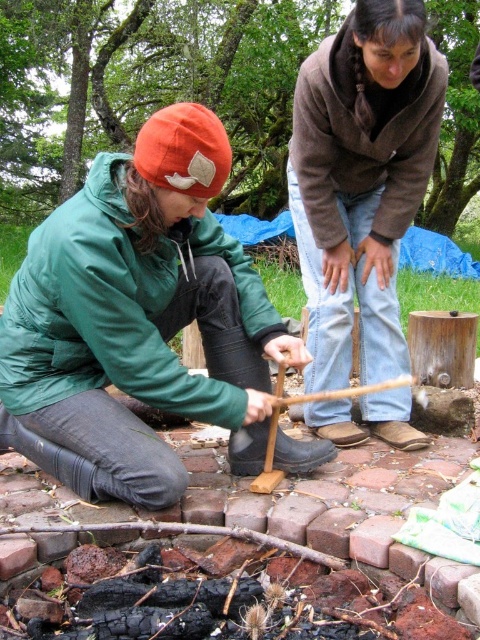
Based on the photo, you are standing at the center of the image and want to move towards the matte green jacket at center. Which direction should you move in?

The matte green jacket at center is located at point 0.500 in the x and 0.287 in the y coordinates, so you should move towards the lower center direction to reach it.

You are a photographer trying to capture a candid shot of both the matte green jacket at center and the brown fuzzy sweater at upper center. Since you want to ensure both are fully visible in the frame, which clothing item should you focus on first to adjust your camera angle?

The matte green jacket at center is shorter than the brown fuzzy sweater at upper center, so you should focus on adjusting your camera angle to ensure the shorter matte green jacket at center is fully visible first.

You are standing in the scene and want to hand a tool to the person wearing the brown fuzzy sweater at upper center. Which direction should you move relative to the matte green jacket at center?

You should move to the right of the matte green jacket at center to reach the brown fuzzy sweater at upper center, since the matte green jacket at center is to the left of the brown fuzzy sweater at upper center.